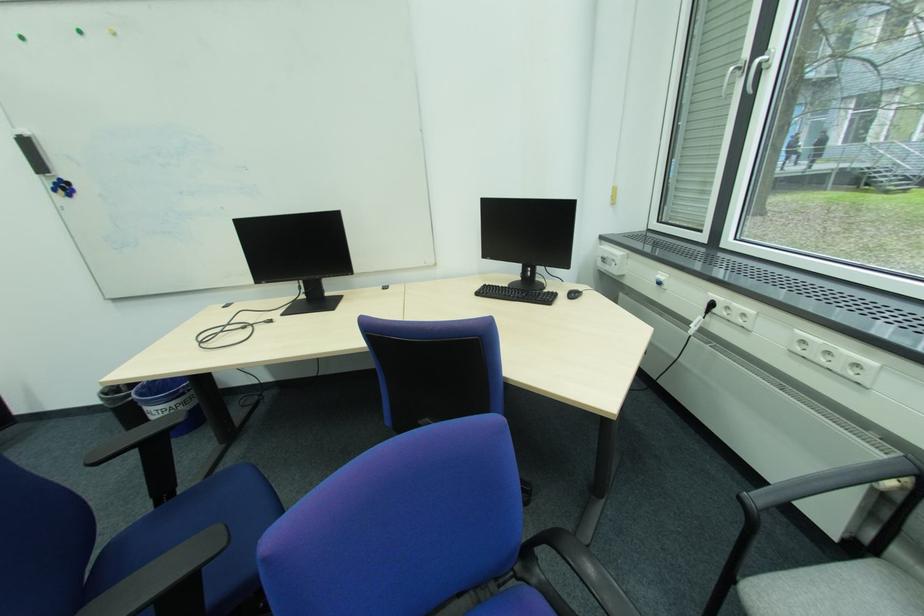
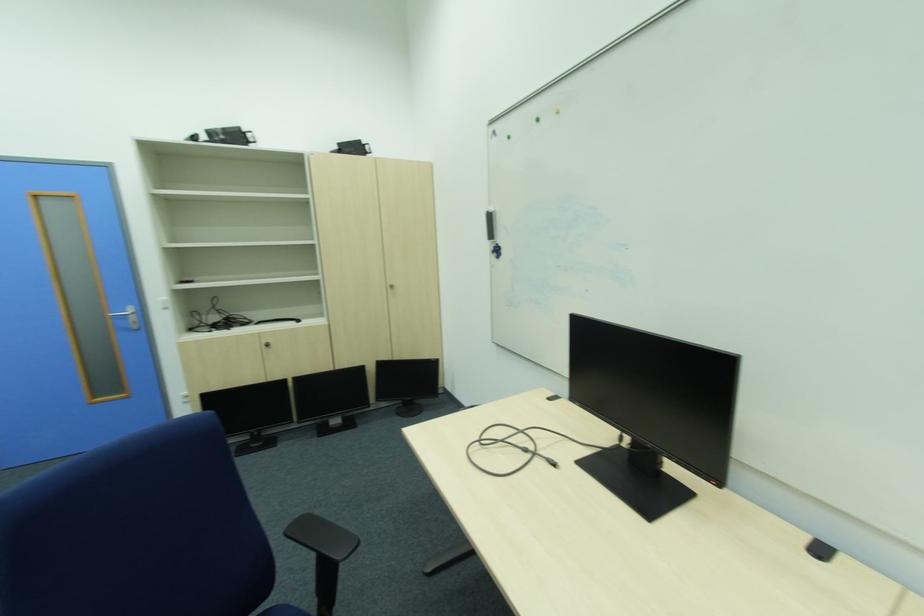
Question: The camera is either moving clockwise (left) or counter-clockwise (right) around the object. The first image is from the beginning of the video and the second image is from the end. Is the camera moving left or right when shooting the video?

Choices:
 (A) Left
 (B) Right

Answer: (B)